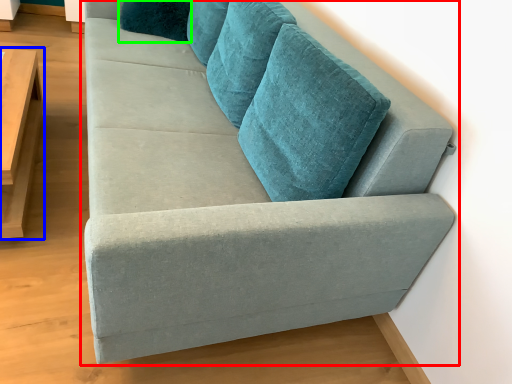
Question: Considering the real-world distances, which object is farthest from studio couch (highlighted by a red box)? table (highlighted by a blue box) or pillow (highlighted by a green box)?

Choices:
 (A) table
 (B) pillow

Answer: (B)